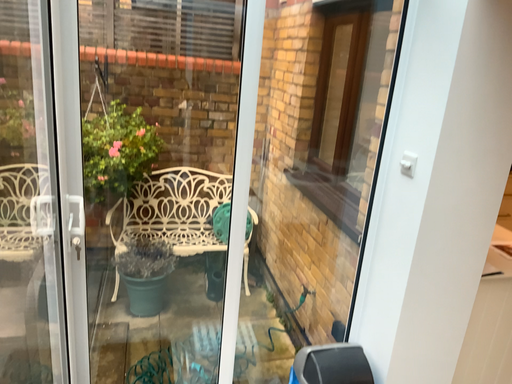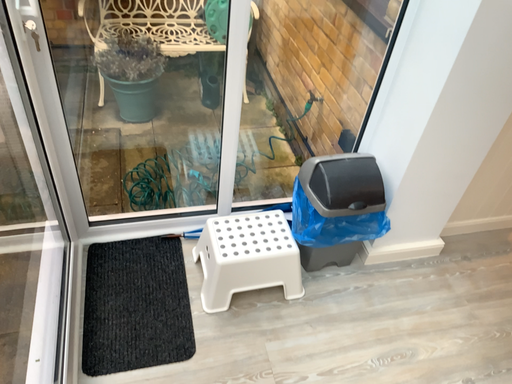
Question: How did the camera likely rotate when shooting the video?

Choices:
 (A) rotated upward
 (B) rotated downward

Answer: (B)